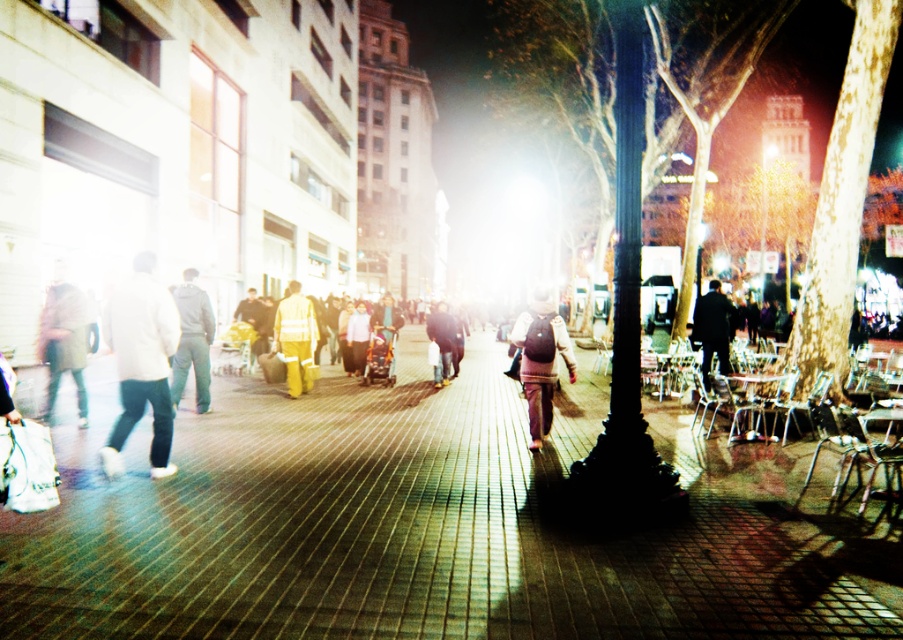
You are a delivery person who needs to place a package on the walkway in the image. The package must be placed exactly at the coordinates given in the description. Where should you place the package relative to the white matte jacket at left?

The package should be placed at the coordinates specified for the white matte jacket at left, which is at point (141, 362). Since the jacket is already at that location, the package should be placed there as well.

You are standing at the edge of the walkway and want to reach the black polished pole at center. What are the coordinates of the pole to navigate towards?

The coordinates of the black polished pole at center are at point (626,317).